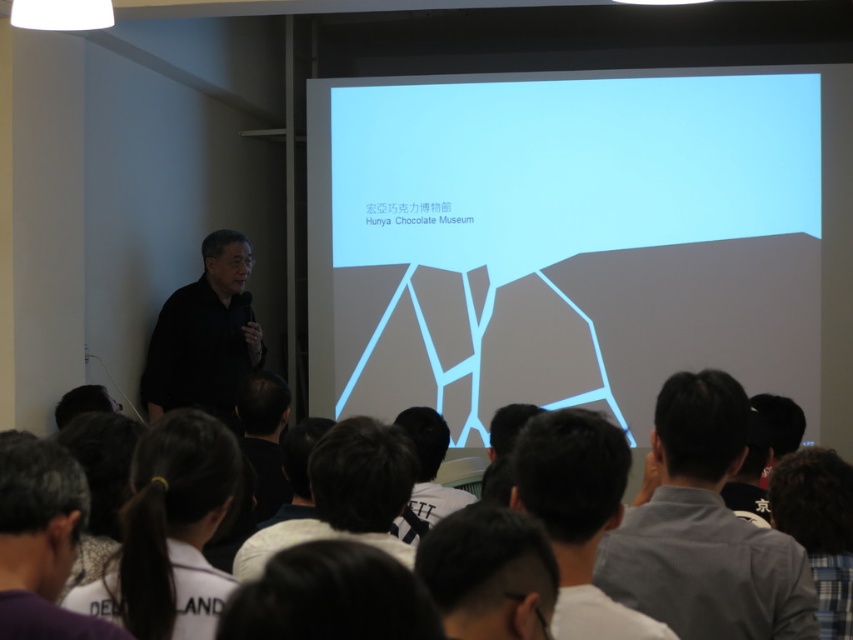
Is point (221, 362) behind point (848, 598)?

Yes, it is behind point (848, 598).

Can you confirm if black matte shirt at left is positioned to the right of dark brown hair at lower right?

Incorrect, black matte shirt at left is not on the right side of dark brown hair at lower right.

Which is in front, point (215, 362) or point (776, 506)?

Point (776, 506) is more forward.

Where is `black matte shirt at left`? This screenshot has width=853, height=640. black matte shirt at left is located at coordinates (206, 336).

Does white fabric ponytail at lower center appear over black matte shirt at left?

No.

Does white fabric ponytail at lower center have a greater height compared to black matte shirt at left?

No, white fabric ponytail at lower center is not taller than black matte shirt at left.

Who is more distant from viewer, (204, 492) or (247, 307)?

The point (247, 307) is more distant.

Where is `white fabric ponytail at lower center`? This screenshot has height=640, width=853. white fabric ponytail at lower center is located at coordinates (170, 532).

Who is higher up, dark gray shirt at lower right or dark gray shirt at center?

Positioned higher is dark gray shirt at lower right.

Is dark gray shirt at lower right wider than dark gray shirt at center?

Yes, dark gray shirt at lower right is wider than dark gray shirt at center.

Between point (805, 627) and point (239, 561), which one is positioned in front?

Point (805, 627) is in front.

Find the location of a particular element. This screenshot has width=853, height=640. dark gray shirt at lower right is located at coordinates (704, 529).